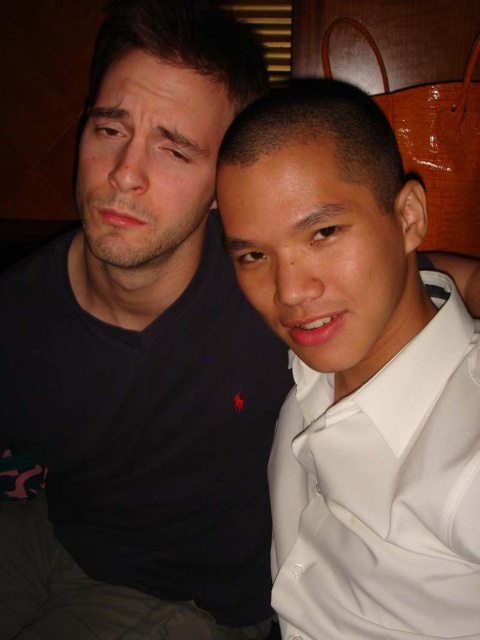
Does black matte shirt at left appear under white satin dress shirt at right?

No.

This screenshot has width=480, height=640. In order to click on black matte shirt at left in this screenshot , I will do `click(143, 360)`.